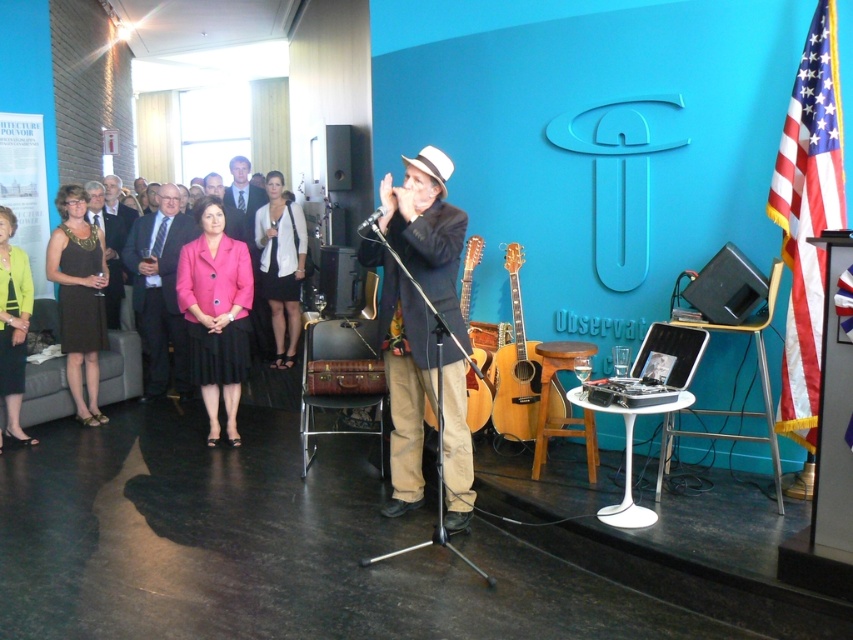
Question: Can you confirm if matte yellow blazer at left is positioned to the right of wooden stool at center?

Choices:
 (A) no
 (B) yes

Answer: (A)

Question: Which object is farther from the camera taking this photo?

Choices:
 (A) matte yellow blazer at left
 (B) acoustic wood guitar at center
 (C) pink fabric jacket at center
 (D) matte brown leather jacket at center

Answer: (C)

Question: Does matte brown leather jacket at center come in front of wooden stool at center?

Choices:
 (A) no
 (B) yes

Answer: (B)

Question: Does dark blue suit at center appear on the left side of wooden stool at center?

Choices:
 (A) yes
 (B) no

Answer: (A)

Question: Among these objects, which one is nearest to the camera?

Choices:
 (A) matte yellow blazer at left
 (B) white matte blazer at center
 (C) light brown wooden guitar at center

Answer: (C)

Question: Which point is closer to the camera taking this photo?

Choices:
 (A) (294, 323)
 (B) (10, 419)

Answer: (B)